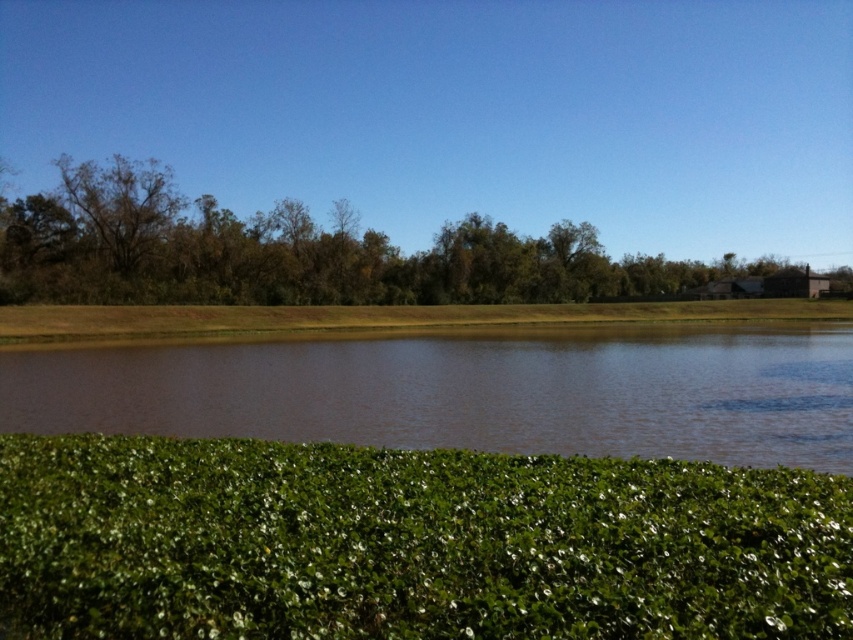
Does green leafy plant at lower center lie behind brown water at center?

No, green leafy plant at lower center is in front of brown water at center.

Which is behind, point (370, 609) or point (314, 413)?

Point (314, 413)

Locate an element on the screen. This screenshot has height=640, width=853. green leafy plant at lower center is located at coordinates (410, 544).

What do you see at coordinates (410, 544) in the screenshot? The image size is (853, 640). I see `green leafy plant at lower center` at bounding box center [410, 544].

Which is below, green leafy plant at lower center or green leafy trees at upper center?

green leafy plant at lower center is below.

Is point (248, 532) in front of point (138, 273)?

Yes, point (248, 532) is in front of point (138, 273).

The image size is (853, 640). What are the coordinates of `green leafy plant at lower center` in the screenshot? It's located at (410, 544).

Where is `green leafy plant at lower center`? The width and height of the screenshot is (853, 640). green leafy plant at lower center is located at coordinates (410, 544).

How far apart are green leafy plant at lower center and brown textured tree at upper left?

A distance of 85.76 meters exists between green leafy plant at lower center and brown textured tree at upper left.

You are a GUI agent. You are given a task and a screenshot of the screen. Output one action in this format:
    pyautogui.click(x=<x>, y=<y>)
    Task: Click on the green leafy plant at lower center
    
    Given the screenshot: What is the action you would take?
    pyautogui.click(x=410, y=544)